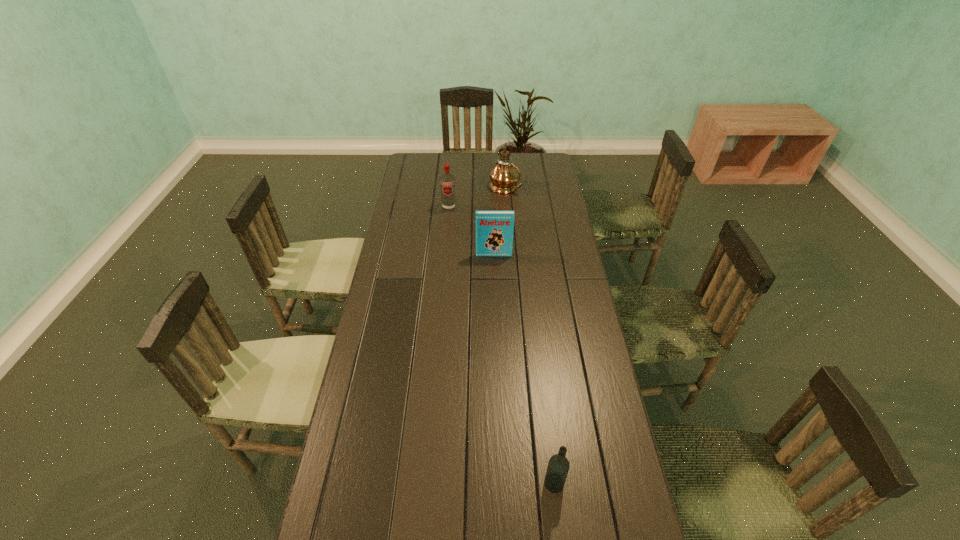
At what (x,y) coordinates should I click in order to perform the action: click on the farthest object. Please return your answer as a coordinate pair (x, y). Looking at the image, I should click on (504, 177).

What are the coordinates of `the tallest object` in the screenshot? It's located at (504, 177).

You are a GUI agent. You are given a task and a screenshot of the screen. Output one action in this format:
    pyautogui.click(x=<x>, y=<y>)
    Task: Click on the taller vodka
    
    Given the screenshot: What is the action you would take?
    pyautogui.click(x=447, y=181)

I want to click on the farther vodka, so click(447, 181).

At what (x,y) coordinates should I click in order to perform the action: click on the third farthest object. Please return your answer as a coordinate pair (x, y). Looking at the image, I should click on (494, 229).

Locate an element on the screen. The image size is (960, 540). the right vodka is located at coordinates (558, 466).

I want to click on the nearest object, so (x=558, y=466).

Find the location of a particular element. blank area located on the front of the farthest object is located at coordinates (508, 227).

At what (x,y) coordinates should I click in order to perform the action: click on free spot located on the front label of the farther vodka. Please return your answer as a coordinate pair (x, y). The width and height of the screenshot is (960, 540). Looking at the image, I should click on (444, 265).

Where is `free region located 0.140m on the front cover of the book`? free region located 0.140m on the front cover of the book is located at coordinates (494, 281).